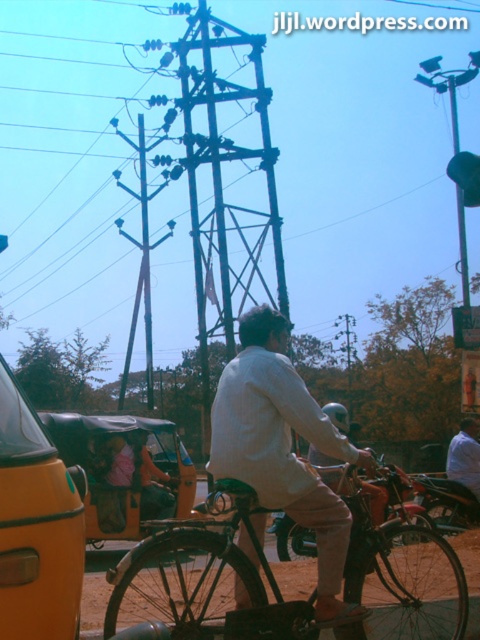
Looking at this image, who is taller, yellow matte auto-rickshaw at lower left or light brown fabric shirt at center?

yellow matte auto-rickshaw at lower left is taller.

Can you confirm if yellow matte auto-rickshaw at lower left is positioned to the left of light brown fabric shirt at center?

Yes, yellow matte auto-rickshaw at lower left is to the left of light brown fabric shirt at center.

Is point (152, 452) farther from viewer compared to point (459, 460)?

No, (152, 452) is closer to viewer.

Where is `yellow matte auto-rickshaw at lower left`? The height and width of the screenshot is (640, 480). yellow matte auto-rickshaw at lower left is located at coordinates (124, 470).

Does metallic gray telegraph pole at center have a smaller size compared to light brown fabric shirt at center?

Incorrect, metallic gray telegraph pole at center is not smaller in size than light brown fabric shirt at center.

Can you confirm if metallic gray telegraph pole at center is positioned above light brown fabric shirt at center?

Indeed, metallic gray telegraph pole at center is positioned over light brown fabric shirt at center.

I want to click on metallic gray telegraph pole at center, so click(141, 259).

You are a GUI agent. You are given a task and a screenshot of the screen. Output one action in this format:
    pyautogui.click(x=<x>, y=<y>)
    Task: Click on the metallic gray telegraph pole at center
    This screenshot has width=480, height=640.
    Given the screenshot: What is the action you would take?
    pyautogui.click(x=141, y=259)

Who is more forward, (231,348) or (35,452)?

Positioned in front is point (35,452).

Can you confirm if metallic structure at center is smaller than yellow matte taxi at left?

No, metallic structure at center is not smaller than yellow matte taxi at left.

This screenshot has height=640, width=480. What do you see at coordinates (223, 186) in the screenshot?
I see `metallic structure at center` at bounding box center [223, 186].

What are the coordinates of `metallic structure at center` in the screenshot? It's located at (223, 186).